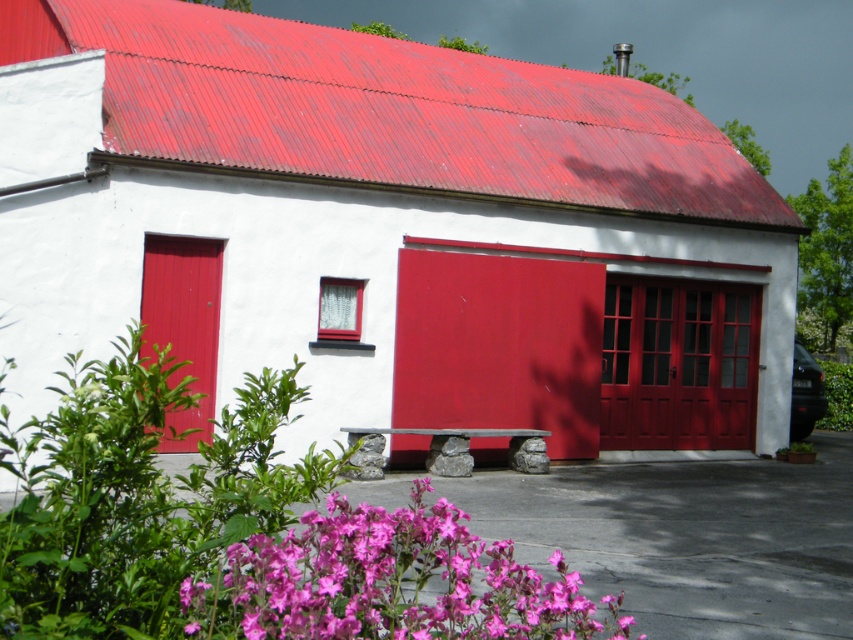
Does smooth white barn at center appear on the left side of matte red door at center?

Indeed, smooth white barn at center is positioned on the left side of matte red door at center.

Which is below, smooth white barn at center or matte red door at center?

matte red door at center is below.

Describe the element at coordinates (372, 221) in the screenshot. The height and width of the screenshot is (640, 853). I see `smooth white barn at center` at that location.

At what (x,y) coordinates should I click in order to perform the action: click on smooth white barn at center. Please return your answer as a coordinate pair (x, y). This screenshot has height=640, width=853. Looking at the image, I should click on (372, 221).

Which is behind, point (527, 145) or point (421, 440)?

The point (527, 145) is behind.

Which is behind, point (480, 189) or point (450, 273)?

The point (450, 273) is more distant.

Locate an element on the screen. metallic red roof at upper center is located at coordinates (389, 113).

Between smooth white barn at center and pink matte flowers at lower center, which one is positioned lower?

pink matte flowers at lower center is below.

Can you confirm if smooth white barn at center is positioned below pink matte flowers at lower center?

Actually, smooth white barn at center is above pink matte flowers at lower center.

Measure the distance between point (68, 147) and camera.

Point (68, 147) is 9.93 meters away from camera.

At what (x,y) coordinates should I click in order to perform the action: click on smooth white barn at center. Please return your answer as a coordinate pair (x, y). Image resolution: width=853 pixels, height=640 pixels. Looking at the image, I should click on (372, 221).